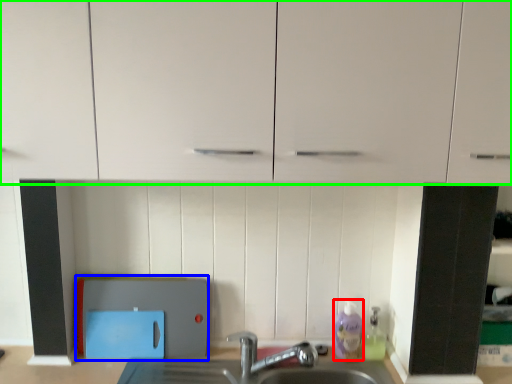
Question: Based on their relative distances, which object is farther from cleaning product (highlighted by a red box)? Choose from appliance (highlighted by a blue box) and cabinetry (highlighted by a green box).

Choices:
 (A) appliance
 (B) cabinetry

Answer: (B)